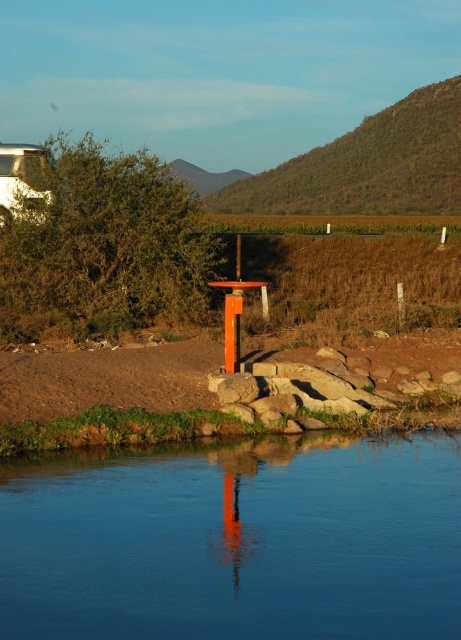
Can you confirm if transparent glass river at center is positioned below green leafy hillside at upper center?

Answer: Correct, transparent glass river at center is located below green leafy hillside at upper center.

Can you confirm if transparent glass river at center is shorter than green leafy hillside at upper center?

Yes, transparent glass river at center is shorter than green leafy hillside at upper center.

Find the location of a particular element. transparent glass river at center is located at coordinates [x=236, y=541].